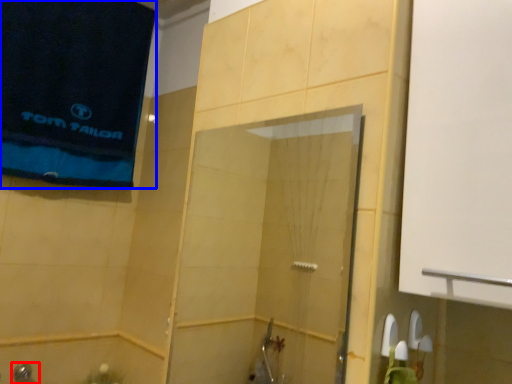
Question: Which object appears closest to the camera in this image, shower (highlighted by a red box) or beach towel (highlighted by a blue box)?

Choices:
 (A) shower
 (B) beach towel

Answer: (B)